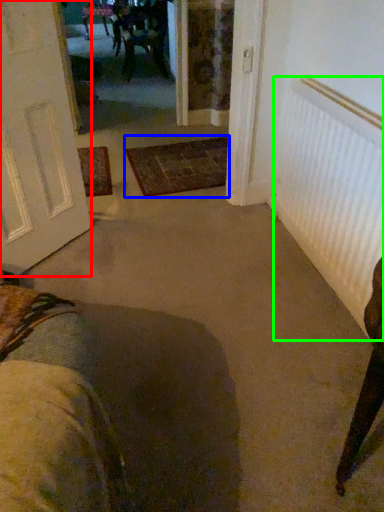
Question: Which object is positioned farthest from door (highlighted by a red box)? Select from doormat (highlighted by a blue box) and radiator (highlighted by a green box).

Choices:
 (A) doormat
 (B) radiator

Answer: (B)